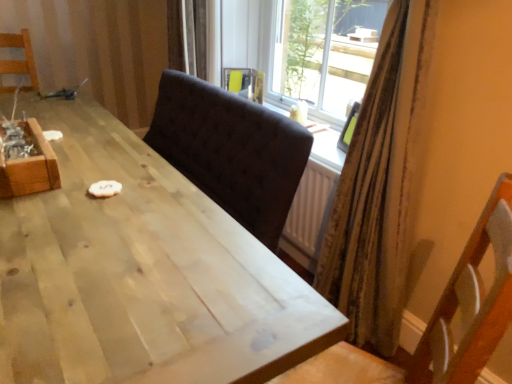
Question: From a real-world perspective, is wooden chair at left, which ranks as the 1th chair in top-to-bottom order, above or below dark fabric chair at center, placed as the 2th chair when sorted from top to bottom?

Choices:
 (A) below
 (B) above

Answer: (B)

Question: Based on their positions, is wooden chair at left, marked as the 2th chair in a front-to-back arrangement, located to the left or right of dark fabric chair at center, placed as the 2th chair when sorted from top to bottom?

Choices:
 (A) left
 (B) right

Answer: (A)

Question: Which object is positioned farthest from the wooden crate at left?

Choices:
 (A) light wood table at center
 (B) dark fabric chair at center, arranged as the 1th chair when viewed from the right
 (C) wooden chair at left, arranged as the second chair when viewed from the right

Answer: (C)

Question: Estimate the real-world distances between objects in this image. Which object is closer to the wooden crate at left?

Choices:
 (A) light wood table at center
 (B) dark fabric chair at center, placed as the 2th chair when sorted from back to front
 (C) wooden chair at left, marked as the 2th chair in a front-to-back arrangement

Answer: (A)